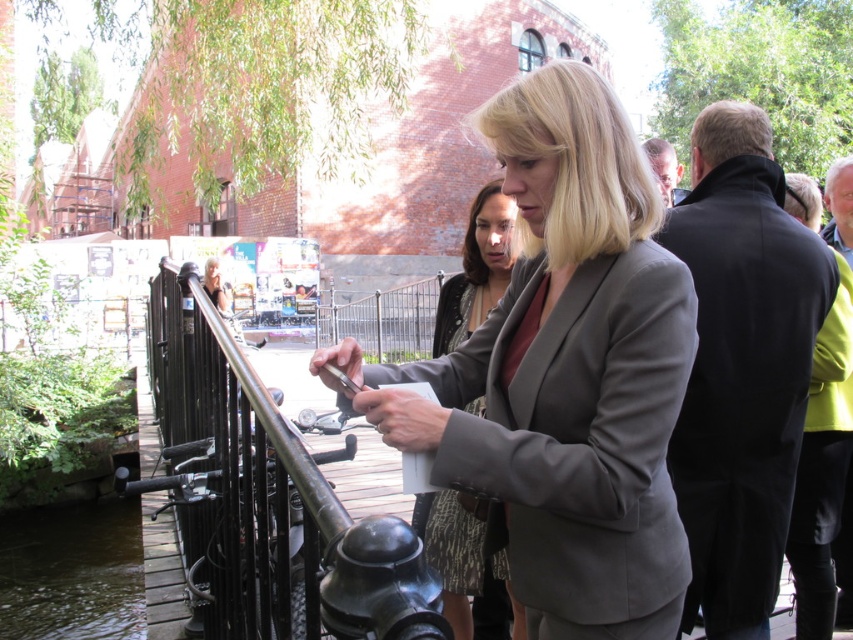
Question: Does black metal railing at center appear under black matte suit at right?

Choices:
 (A) no
 (B) yes

Answer: (B)

Question: Is black metal railing at center smaller than gray fabric jacket at center?

Choices:
 (A) yes
 (B) no

Answer: (B)

Question: Which object is farther from the camera taking this photo?

Choices:
 (A) gray fabric jacket at center
 (B) brown liquid water at lower left
 (C) black metal railing at center

Answer: (B)

Question: Which of the following is the closest to the observer?

Choices:
 (A) gray fabric jacket at center
 (B) matte gray blazer at center

Answer: (B)

Question: Does black matte suit at right have a smaller size compared to gray fabric jacket at center?

Choices:
 (A) no
 (B) yes

Answer: (B)

Question: Which point is farther to the camera?

Choices:
 (A) black metal railing at center
 (B) brown liquid water at lower left
 (C) black matte suit at right
 (D) gray fabric jacket at center

Answer: (B)